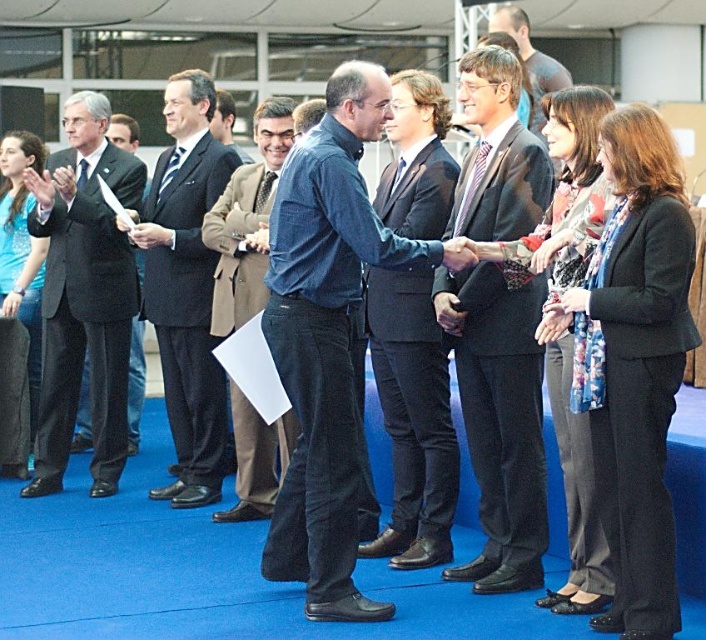
In the scene shown: Between dark suit at left and matte black hand at center, which one appears on the left side from the viewer's perspective?

dark suit at left is more to the left.

Who is higher up, dark suit at left or matte black hand at center?

matte black hand at center is higher up.

Which is behind, point (136, 182) or point (453, 246)?

Positioned behind is point (136, 182).

Where is `dark suit at left`? dark suit at left is located at coordinates (83, 294).

Who is more forward, (662,513) or (450,256)?

Point (662,513) is more forward.

Between point (676, 285) and point (450, 262), which one is positioned behind?

The point (450, 262) is more distant.

You are a GUI agent. You are given a task and a screenshot of the screen. Output one action in this format:
    pyautogui.click(x=<x>, y=<y>)
    Task: Click on the black wool suit at right
    
    Given the screenshot: What is the action you would take?
    pyautogui.click(x=640, y=404)

Can you confirm if black wool suit at right is bigger than dark blue suit at center?

No.

Is point (652, 452) positioned behind point (205, 404)?

That is False.

Image resolution: width=706 pixels, height=640 pixels. I want to click on black wool suit at right, so click(x=640, y=404).